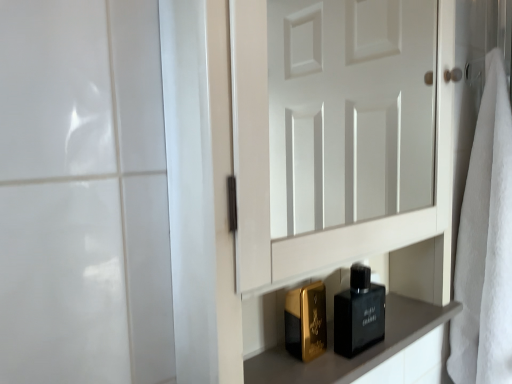
Question: Is point (339, 304) closer or farther from the camera than point (258, 377)?

Choices:
 (A) closer
 (B) farther

Answer: (B)

Question: From their relative heights in the image, would you say black glass perfume at lower center is taller or shorter than matte black perfume bottles at lower center?

Choices:
 (A) tall
 (B) short

Answer: (A)

Question: Estimate the real-world distances between objects in this image. Which object is farther from the black glass perfume at lower center?

Choices:
 (A) white soft towel at right
 (B) matte black perfume bottles at lower center

Answer: (A)

Question: Which object is positioned farthest from the black glass perfume at lower center?

Choices:
 (A) white soft towel at right
 (B) matte black perfume bottles at lower center

Answer: (A)